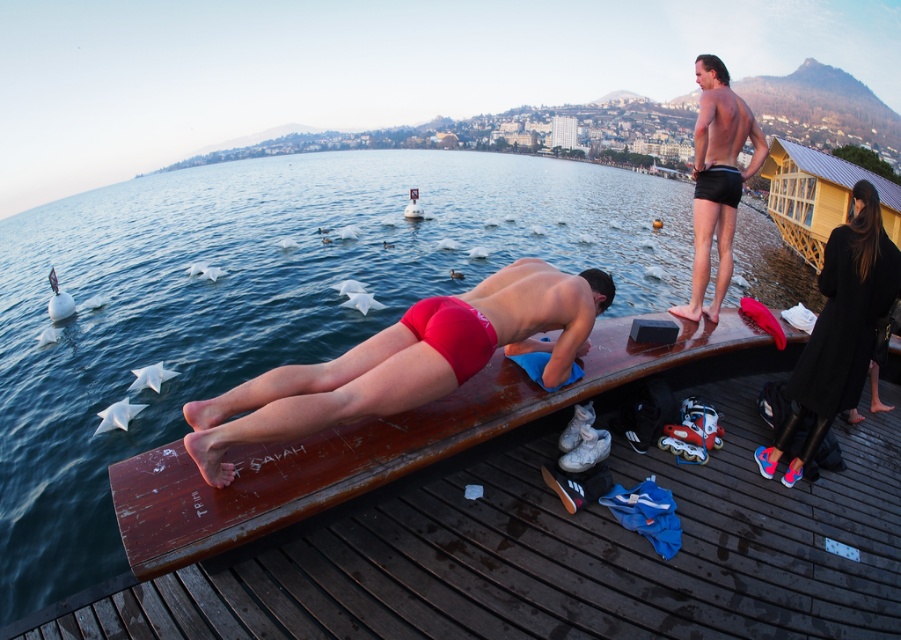
Does wooden dock at center appear under black leather pants at right?

No, wooden dock at center is not below black leather pants at right.

Is point (1, 344) farther from camera compared to point (805, 390)?

Yes, it is.

Locate an element on the screen. This screenshot has width=901, height=640. wooden dock at center is located at coordinates (261, 301).

Between point (223, 330) and point (479, 330), which one is positioned in front?

Point (479, 330)

Does wooden dock at center appear over smooth black dress at upper right?

Indeed, wooden dock at center is positioned over smooth black dress at upper right.

Is point (59, 593) positioned in front of point (480, 332)?

No, (59, 593) is behind (480, 332).

Locate an element on the screen. wooden dock at center is located at coordinates (261, 301).

Is wooden dock at center smaller than shiny black shorts at upper right?

Incorrect, wooden dock at center is not smaller in size than shiny black shorts at upper right.

Can you confirm if wooden dock at center is shorter than shiny black shorts at upper right?

Incorrect, wooden dock at center's height does not fall short of shiny black shorts at upper right's.

Which is behind, point (476, 262) or point (742, 177)?

The point (476, 262) is more distant.

Image resolution: width=901 pixels, height=640 pixels. Identify the location of wooden dock at center. (261, 301).